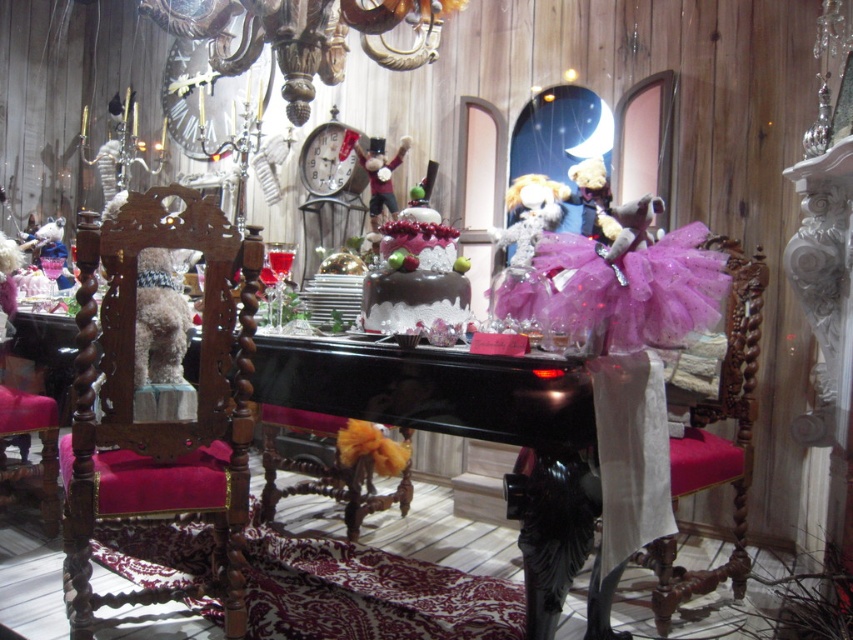
Is wooden chair with velvet cushion at center shorter than velvet teddy bear at center?

Incorrect, wooden chair with velvet cushion at center's height does not fall short of velvet teddy bear at center's.

Who is more forward, (102,397) or (614,236)?

Point (102,397) is in front.

Find the location of a particular element. wooden chair with velvet cushion at center is located at coordinates [x=157, y=419].

Between chocolate frosted cake at center and velvet teddy bear at center, which one is positioned lower?

chocolate frosted cake at center

Is chocolate frosted cake at center above velvet teddy bear at center?

Incorrect, chocolate frosted cake at center is not positioned above velvet teddy bear at center.

Measure the distance between point (447, 314) and camera.

A distance of 2.12 meters exists between point (447, 314) and camera.

At what (x,y) coordinates should I click in order to perform the action: click on chocolate frosted cake at center. Please return your answer as a coordinate pair (x, y). The image size is (853, 640). Looking at the image, I should click on (416, 272).

Between wooden chair with velvet cushion at center and purple tulle skirt at right, which one is positioned lower?

purple tulle skirt at right

Does wooden chair with velvet cushion at center have a smaller size compared to purple tulle skirt at right?

Indeed, wooden chair with velvet cushion at center has a smaller size compared to purple tulle skirt at right.

The height and width of the screenshot is (640, 853). I want to click on wooden chair with velvet cushion at center, so click(x=157, y=419).